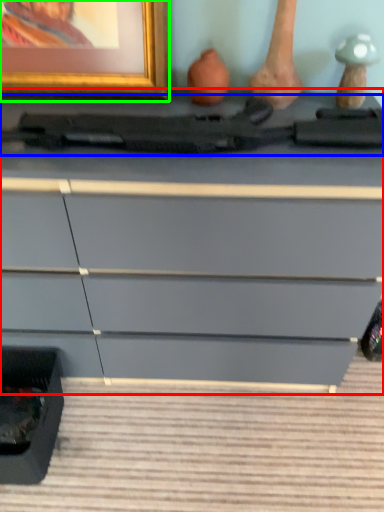
Question: Based on their relative distances, which object is farther from chest of drawers (highlighted by a red box)? Choose from equipment (highlighted by a blue box) and picture frame (highlighted by a green box).

Choices:
 (A) equipment
 (B) picture frame

Answer: (B)